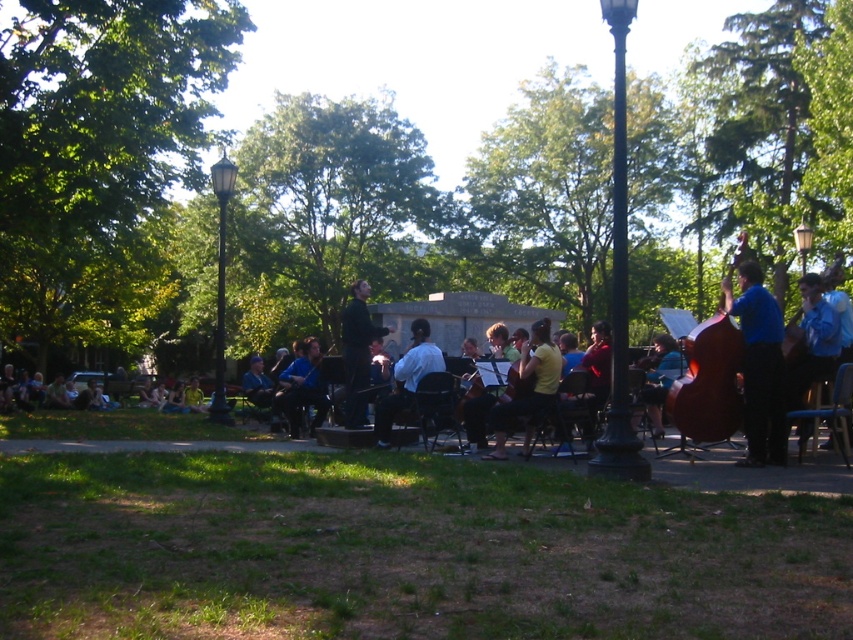
You are standing at the center of the image and want to locate the light blue shirt at center. According to the coordinates provided, in which direction should you look to find it?

The light blue shirt at center is located at coordinates point (407, 378), which means it is slightly to the right and above the exact center of the image.

You are attending an outdoor concert and notice two items in the scene. One is the blue fabric shirt at right and the other is the black polished lamp post at upper right. Which of these two items is narrower in width?

The blue fabric shirt at right is thinner than the black polished lamp post at upper right, so the blue fabric shirt at right is narrower in width.

You are standing at the center of the image and want to locate the black glass lamp post at center. According to the coordinates provided, in which direction should you look to find it?

The black glass lamp post at center is located at coordinates point (x=221, y=285), which means it is slightly to the right and above the center point of the image.